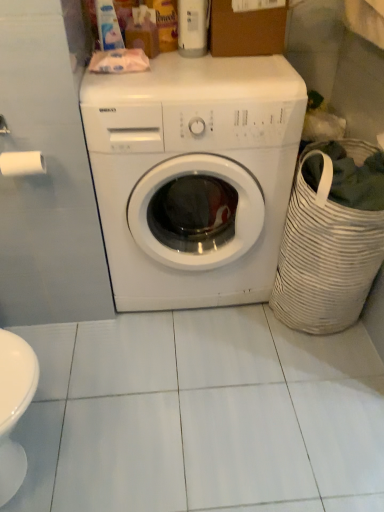
Question: Looking at their shapes, would you say white woven laundry basket at right is wider or thinner than white glossy washing machine at center?

Choices:
 (A) thin
 (B) wide

Answer: (A)

Question: Is point (365, 211) closer or farther from the camera than point (230, 144)?

Choices:
 (A) farther
 (B) closer

Answer: (B)

Question: Estimate the real-world distances between objects in this image. Which object is closer to the white matte toilet paper at left?

Choices:
 (A) white woven laundry basket at right
 (B) brown cardboard box at upper center
 (C) white glossy washing machine at center

Answer: (C)

Question: Which is nearer to the white matte toilet paper at left?

Choices:
 (A) white glossy washing machine at center
 (B) white woven laundry basket at right
 (C) brown cardboard box at upper center

Answer: (A)